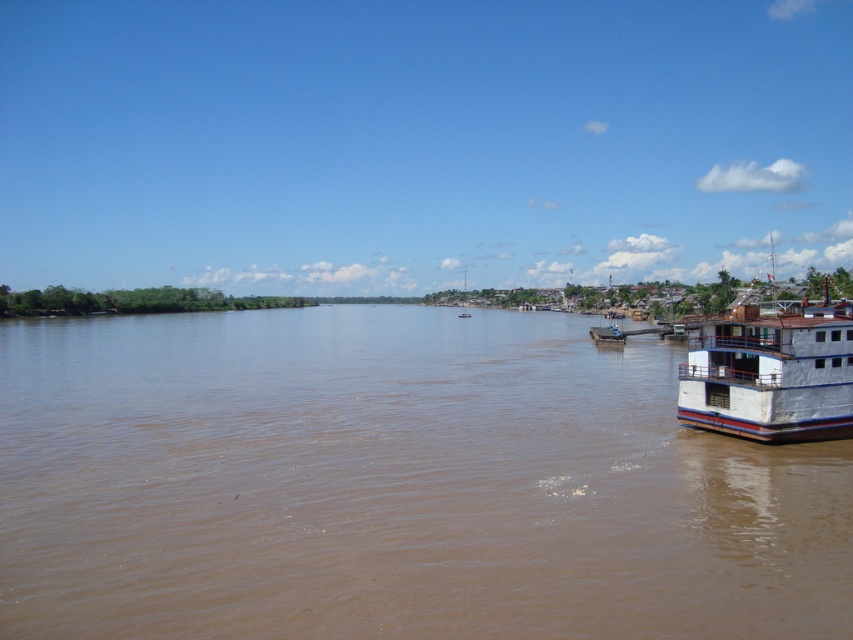
Who is higher up, brown muddy water at center or white plastic boat at center?

white plastic boat at center is higher up.

Which of these two, brown muddy water at center or white plastic boat at center, stands taller?

With more height is brown muddy water at center.

Does point (258, 464) come farther from viewer compared to point (621, 344)?

No, (258, 464) is in front of (621, 344).

Identify the location of brown muddy water at center. (393, 484).

Does white painted wood boat at right have a greater height compared to white matte boat at center?

Yes.

Based on the photo, can you confirm if white painted wood boat at right is thinner than white matte boat at center?

Incorrect, white painted wood boat at right's width is not less than white matte boat at center's.

Which is behind, point (677, 374) or point (467, 314)?

Point (467, 314)

Find the location of `white painted wood boat at right`. white painted wood boat at right is located at coordinates (770, 371).

Does white plastic boat at center have a greater height compared to white matte boat at center?

In fact, white plastic boat at center may be shorter than white matte boat at center.

Does white plastic boat at center lie in front of white matte boat at center?

Yes, white plastic boat at center is closer to the viewer.

What do you see at coordinates (608, 333) in the screenshot? The height and width of the screenshot is (640, 853). I see `white plastic boat at center` at bounding box center [608, 333].

Locate an element on the screen. The image size is (853, 640). white plastic boat at center is located at coordinates (608, 333).